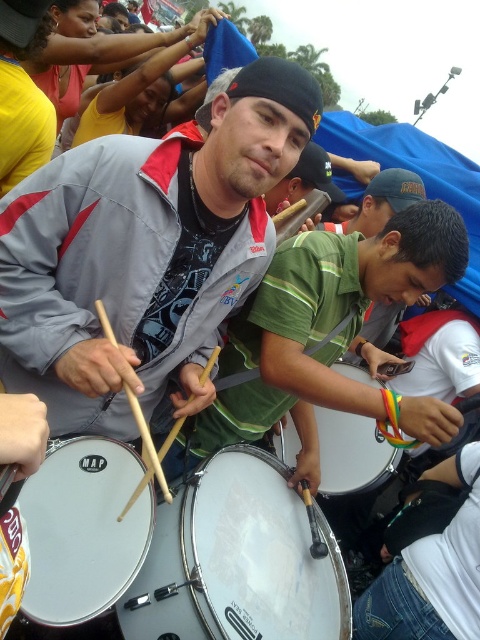
Question: Is white glossy drum at center to the right of green matte shirt at center from the viewer's perspective?

Choices:
 (A) yes
 (B) no

Answer: (B)

Question: Which point is farther to the camera?

Choices:
 (A) (x=384, y=211)
 (B) (x=118, y=451)
 (C) (x=299, y=506)

Answer: (A)

Question: Can you confirm if gray fabric jacket at center is positioned below white drumhead at center?

Choices:
 (A) no
 (B) yes

Answer: (A)

Question: Which of the following is the farthest from the observer?

Choices:
 (A) (347, 454)
 (B) (251, 541)
 (C) (136, 564)

Answer: (A)

Question: Among these objects, which one is farthest from the camera?

Choices:
 (A) gray fabric jacket at center
 (B) white glossy drum at center
 (C) white drum at center
 (D) green matte shirt at center

Answer: (D)

Question: Considering the relative positions of gray fabric jacket at center and green matte shirt at center in the image provided, where is gray fabric jacket at center located with respect to green matte shirt at center?

Choices:
 (A) above
 (B) below

Answer: (B)